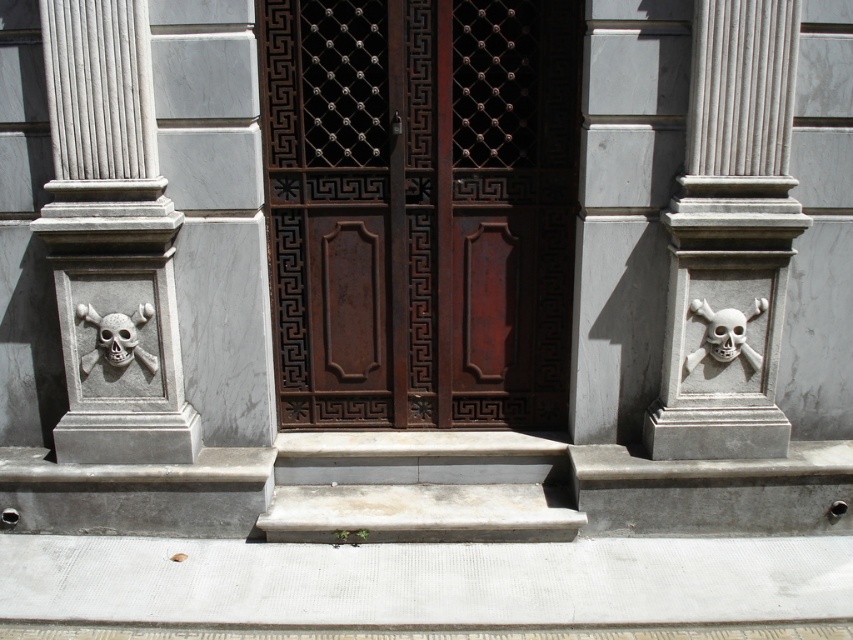
Question: From the image, what is the correct spatial relationship of rusty wood door at center in relation to white stone skull at right?

Choices:
 (A) right
 (B) left

Answer: (B)

Question: In this image, where is white marble skull at left located relative to white matte skull at right?

Choices:
 (A) above
 (B) below

Answer: (A)

Question: Does gray stone skull at center lie behind white concrete stairs at center?

Choices:
 (A) yes
 (B) no

Answer: (B)

Question: Which of the following is the farthest from the observer?

Choices:
 (A) white matte skull at right
 (B) white matte skull at lower left
 (C) white stone skull at right
 (D) rusty wood door at center

Answer: (C)

Question: Which point appears farthest from the camera in this image?

Choices:
 (A) (485, 496)
 (B) (289, 321)
 (C) (718, 28)
 (D) (97, 342)

Answer: (B)

Question: Among these points, which one is farthest from the camera?

Choices:
 (A) (125, 342)
 (B) (724, 316)

Answer: (A)